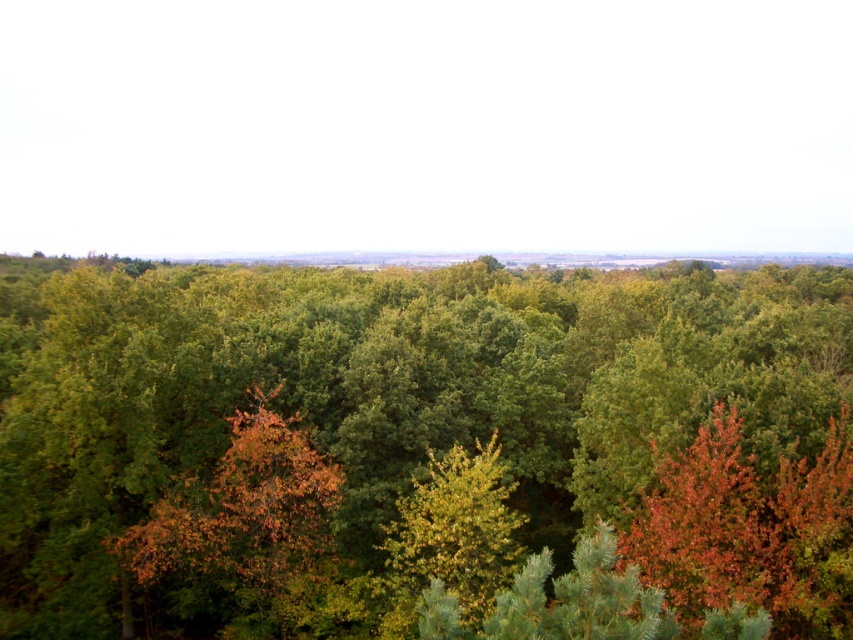
Question: Which point is farther to the camera?

Choices:
 (A) (306, 276)
 (B) (300, 616)

Answer: (A)

Question: Does green leafy forest at center lie behind orange leafy tree at center?

Choices:
 (A) yes
 (B) no

Answer: (B)

Question: Does green leafy forest at center appear on the left side of orange leafy tree at center?

Choices:
 (A) no
 (B) yes

Answer: (B)

Question: Is green leafy forest at center bigger than orange leafy tree at center?

Choices:
 (A) yes
 (B) no

Answer: (A)

Question: Which point is farther to the camera?

Choices:
 (A) (328, 481)
 (B) (693, 452)

Answer: (A)